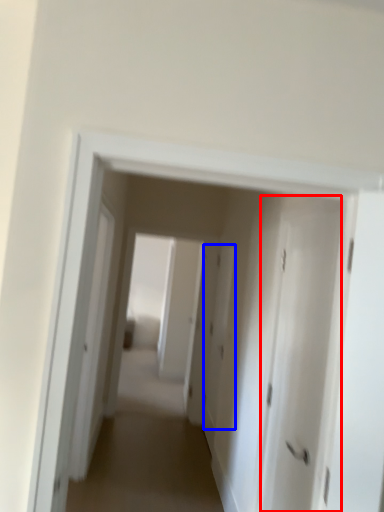
Question: Which object appears farthest to the camera in this image, door (highlighted by a red box) or door (highlighted by a blue box)?

Choices:
 (A) door
 (B) door

Answer: (B)